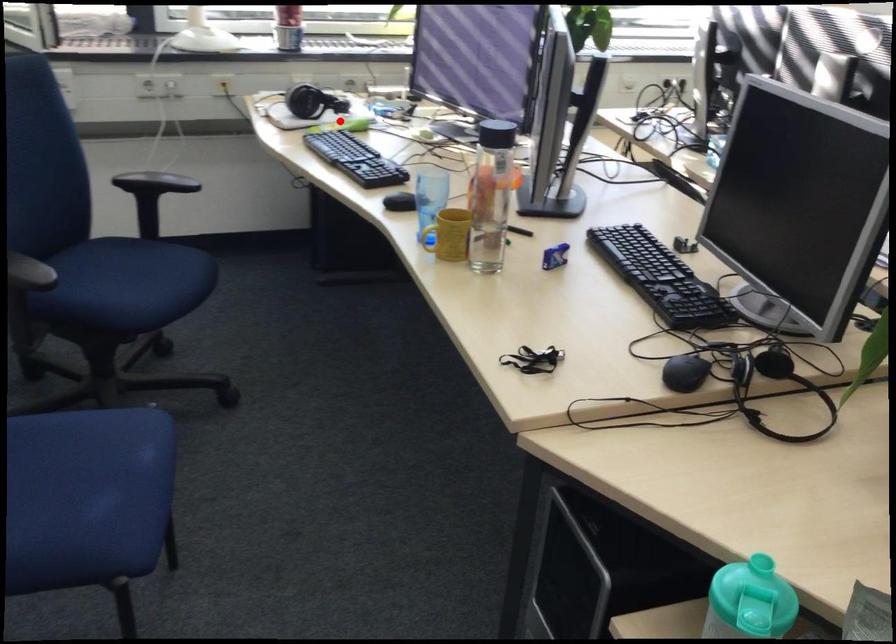
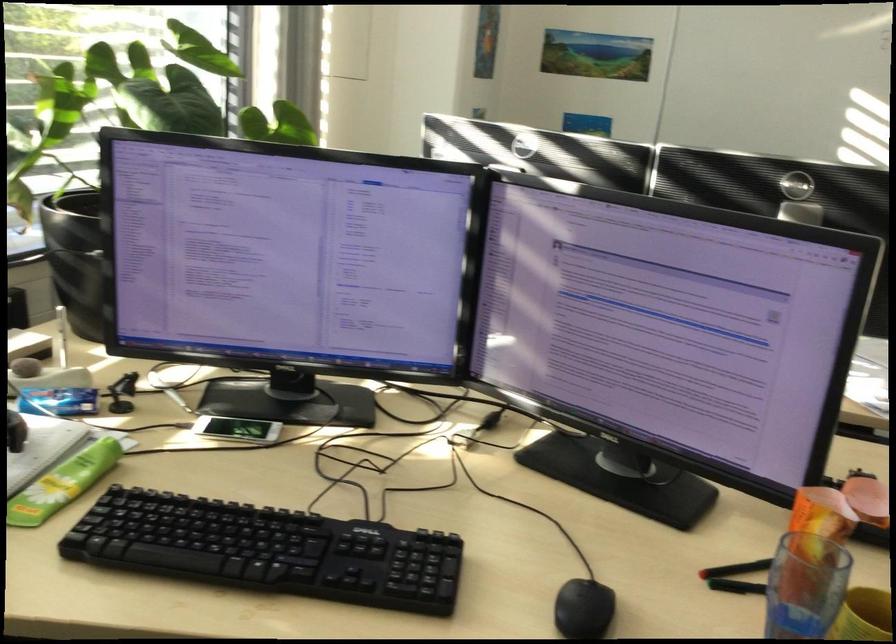
Question: A red point is marked in image1. In image2, is the corresponding 3D point closer to the camera or farther? Reply with the corresponding letter.

Choices:
 (A) The corresponding 3D point is closer.
 (B) The corresponding 3D point is farther.

Answer: (A)